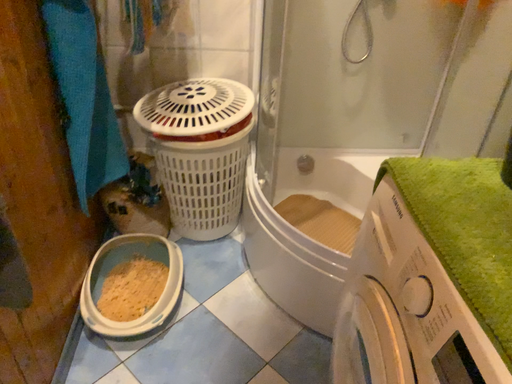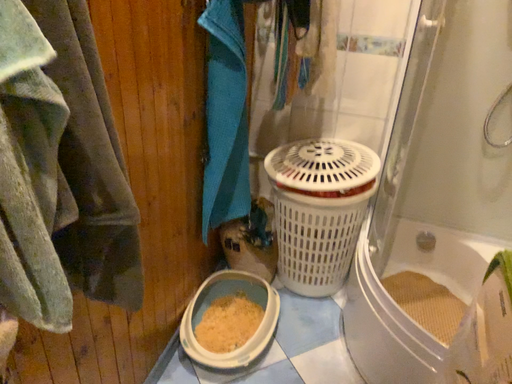
Question: Which way did the camera rotate in the video?

Choices:
 (A) rotated right
 (B) rotated left

Answer: (B)